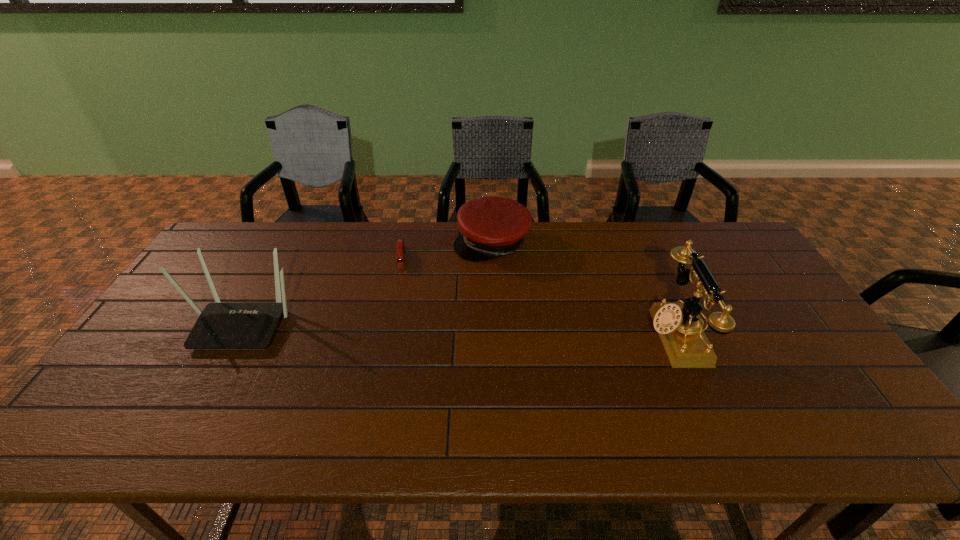
Find the location of a particular element. Image resolution: width=960 pixels, height=540 pixels. free location that satisfies the following two spatial constraints: 1. on the front-facing side of the third shortest object; 2. on the dial of the tallest object is located at coordinates (237, 335).